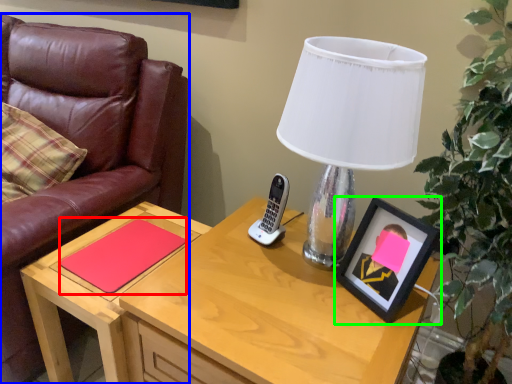
Question: Which is nearer to the notepad (highlighted by a red box)? chair (highlighted by a blue box) or picture frame (highlighted by a green box).

Choices:
 (A) chair
 (B) picture frame

Answer: (A)